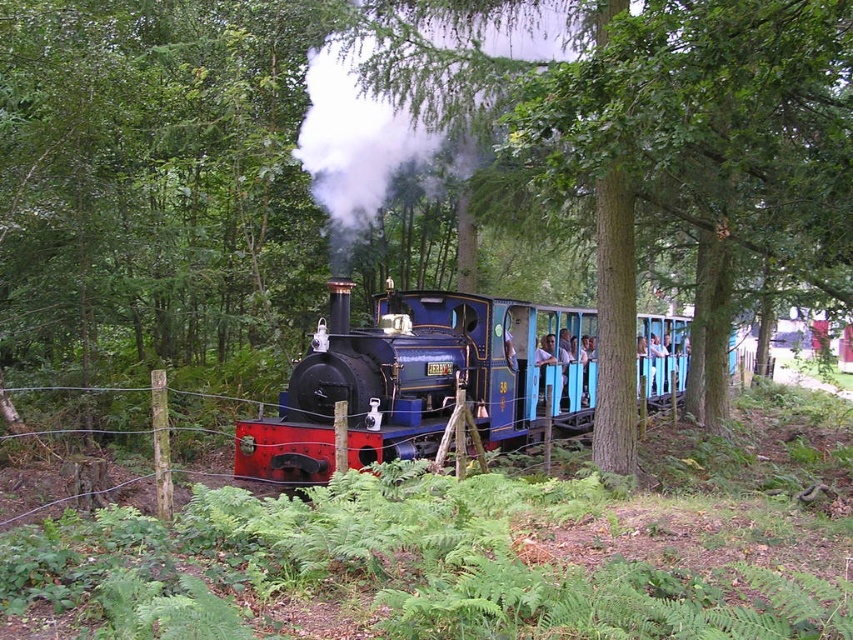
You are a passenger on the steam train journeying through the forest. You notice two locomotives ahead. Which one is closer to you, the shiny blue locomotive at center or the polished black locomotive at center?

The shiny blue locomotive at center is closer to you because it is positioned in front of the polished black locomotive at center.

Based on the photo, you are standing at the camera position observing the steam train journey through the forest. There is a specific point in the scene labeled as point (x=329, y=326). If you want to place a safety barrier 25 feet away from the camera towards that point, will the barrier be closer to the camera or further away from the point compared to the current distance?

The distance between point (x=329, y=326) and the camera is 33.78 feet. Placing a safety barrier 25 feet away from the camera towards that point would position it closer to the camera than the point. Therefore, the barrier will be 25 feet from the camera and 8.78 feet closer to the camera than the point.

You are a photographer trying to capture a photo of the shiny blue locomotive at center and the wire mesh fence at center from the forest. Based on their sizes in the image, which object would appear closer to you?

The wire mesh fence at center appears closer because it is larger than the shiny blue locomotive at center in the image.